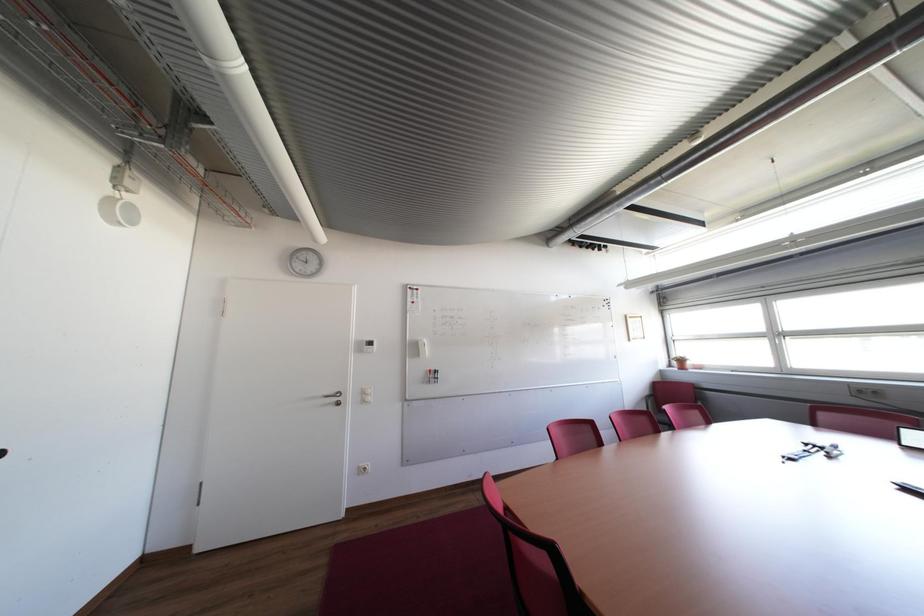
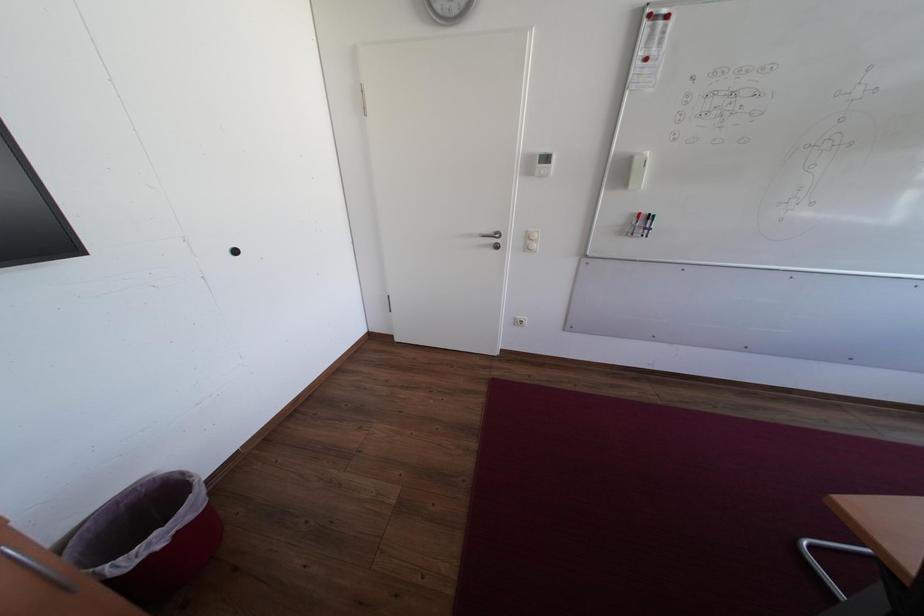
The images are taken continuously from a first-person perspective. In which direction is your viewpoint rotating?

The rotation direction of the camera is left-down.